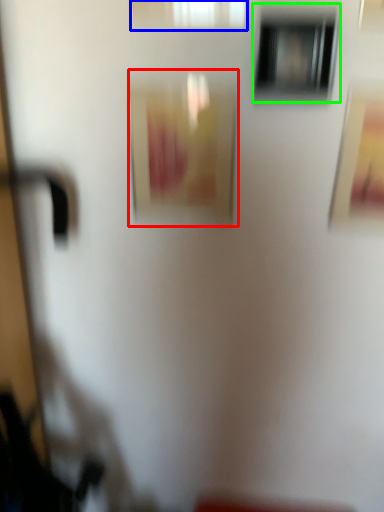
Question: Considering the real-world distances, which object is farthest from picture frame (highlighted by a red box)? window (highlighted by a blue box) or window (highlighted by a green box)?

Choices:
 (A) window
 (B) window

Answer: (A)